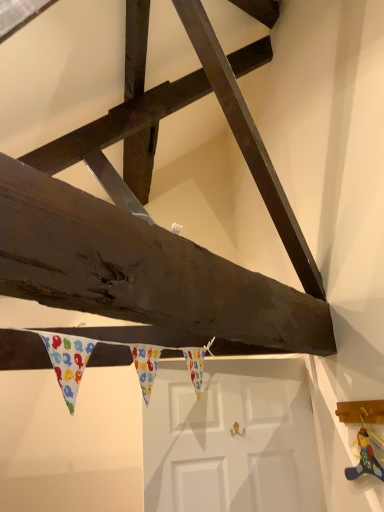
Based on the photo, measure the distance between point (192, 492) and camera.

Point (192, 492) is 1.76 meters away from camera.

The width and height of the screenshot is (384, 512). What do you see at coordinates (232, 439) in the screenshot?
I see `white matte door at center` at bounding box center [232, 439].

You are a GUI agent. You are given a task and a screenshot of the screen. Output one action in this format:
    pyautogui.click(x=<x>, y=<y>)
    Task: Click on the white matte door at center
    This screenshot has height=512, width=384.
    Given the screenshot: What is the action you would take?
    pyautogui.click(x=232, y=439)

In order to face white matte door at center, should I rotate leftwards or rightwards?

To align with it, rotate right about 4.978°.

Describe the element at coordinates (365, 453) in the screenshot. Image resolution: width=384 pixels, height=512 pixels. I see `wooden toy at lower right` at that location.

At what (x,y) coordinates should I click in order to perform the action: click on wooden toy at lower right. Please return your answer as a coordinate pair (x, y). Looking at the image, I should click on (365, 453).

The image size is (384, 512). What are the coordinates of `white matte door at center` in the screenshot? It's located at (232, 439).

Between wooden toy at lower right and white matte door at center, which one appears on the left side from the viewer's perspective?

Positioned to the left is white matte door at center.

Which is in front, wooden toy at lower right or white matte door at center?

wooden toy at lower right is more forward.

Which is closer, (363, 407) or (146, 508)?

The point (363, 407) is closer to the camera.

From the image's perspective, is wooden toy at lower right positioned above or below white matte door at center?

From the image's perspective, wooden toy at lower right appears above white matte door at center.

From a real-world perspective, who is located lower, wooden toy at lower right or white matte door at center?

white matte door at center.

Between wooden toy at lower right and white matte door at center, which one has smaller width?

With smaller width is wooden toy at lower right.

From the picture: Considering the sizes of wooden toy at lower right and white matte door at center in the image, is wooden toy at lower right taller or shorter than white matte door at center?

In the image, wooden toy at lower right appears to be shorter than white matte door at center.

Can you confirm if wooden toy at lower right is bigger than white matte door at center?

Incorrect, wooden toy at lower right is not larger than white matte door at center.

Do you think wooden toy at lower right is within white matte door at center, or outside of it?

wooden toy at lower right is not enclosed by white matte door at center.

Based on the photo, is wooden toy at lower right with white matte door at center?

No, wooden toy at lower right is not with white matte door at center.

Could you tell me if wooden toy at lower right is facing white matte door at center?

No, wooden toy at lower right is not turned towards white matte door at center.

Where is `door directly beneath the wooden toy at lower right (from a real-world perspective)`? The height and width of the screenshot is (512, 384). door directly beneath the wooden toy at lower right (from a real-world perspective) is located at coordinates (232, 439).

Considering the relative positions of white matte door at center and wooden toy at lower right in the image provided, is white matte door at center to the left of wooden toy at lower right from the viewer's perspective?

Yes.

Between white matte door at center and wooden toy at lower right, which one is positioned in front?

wooden toy at lower right.

Which is less distant, (299, 490) or (351, 478)?

Point (351, 478)

From the image's perspective, is white matte door at center beneath wooden toy at lower right?

Yes, from the image's perspective, white matte door at center is below wooden toy at lower right.

From a real-world perspective, is white matte door at center located beneath wooden toy at lower right?

Indeed, from a real-world perspective, white matte door at center is positioned beneath wooden toy at lower right.

Between white matte door at center and wooden toy at lower right, which one has larger width?

white matte door at center.

Between white matte door at center and wooden toy at lower right, which one has less height?

wooden toy at lower right is shorter.

Does white matte door at center have a larger size compared to wooden toy at lower right?

Indeed, white matte door at center has a larger size compared to wooden toy at lower right.

Is white matte door at center inside or outside of wooden toy at lower right?

white matte door at center lies outside wooden toy at lower right.

Does white matte door at center touch wooden toy at lower right?

They are not placed beside each other.

Is wooden toy at lower right at the back of white matte door at center?

Yes.

The width and height of the screenshot is (384, 512). I want to click on toy above the white matte door at center (from the image's perspective), so click(x=365, y=453).

Identify the location of door on the left side of wooden toy at lower right. This screenshot has width=384, height=512. (232, 439).

Find the location of a particular element. The image size is (384, 512). toy that is on the right side of white matte door at center is located at coordinates (365, 453).